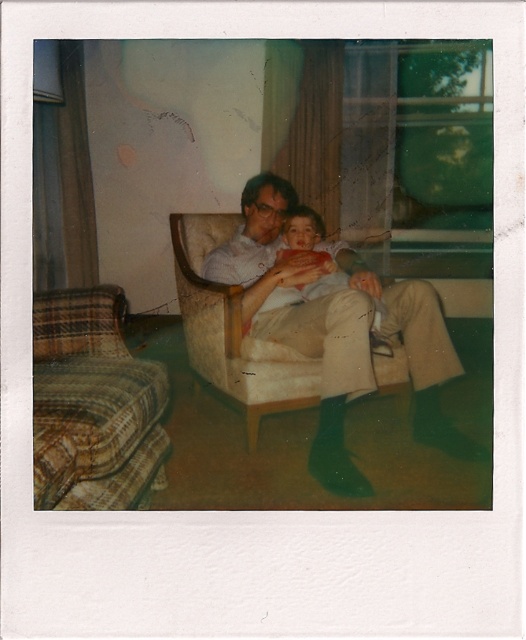
How distant is light brown fabric chair at center from smooth red shirt at center?

A distance of 5.58 inches exists between light brown fabric chair at center and smooth red shirt at center.

Is light brown fabric chair at center taller than smooth red shirt at center?

Yes, light brown fabric chair at center is taller than smooth red shirt at center.

The height and width of the screenshot is (640, 526). What do you see at coordinates (338, 330) in the screenshot?
I see `light brown fabric chair at center` at bounding box center [338, 330].

I want to click on light brown fabric chair at center, so click(x=338, y=330).